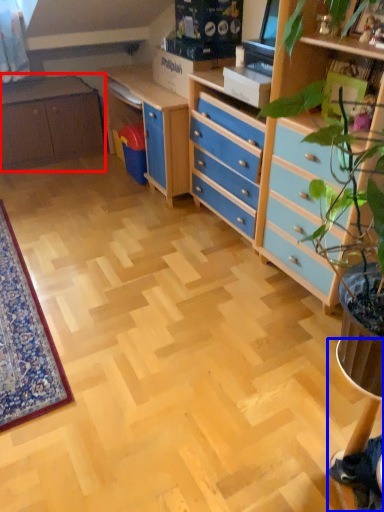
Question: Which of the following is the farthest to the observer, cabinetry (highlighted by a red box) or computer desk (highlighted by a blue box)?

Choices:
 (A) cabinetry
 (B) computer desk

Answer: (A)